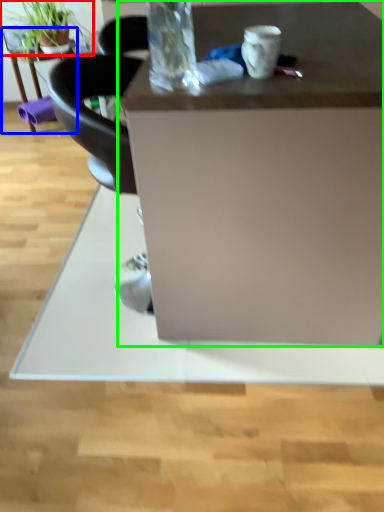
Question: Which object is the closest to the houseplant (highlighted by a red box)? Choose among these: table (highlighted by a blue box) or desk (highlighted by a green box).

Choices:
 (A) table
 (B) desk

Answer: (A)